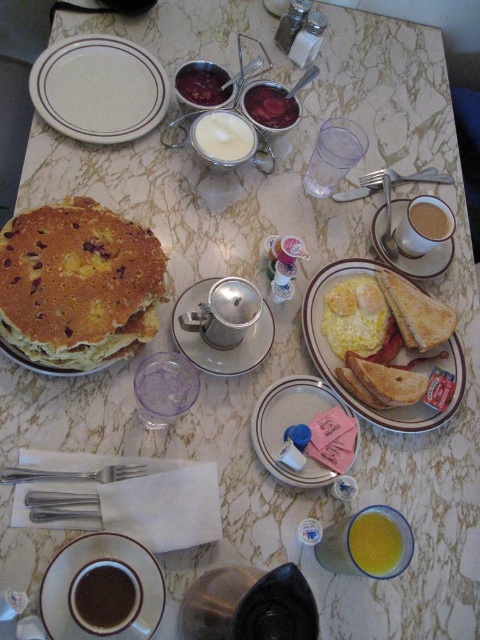
Question: In this image, where is pink paper at center located relative to dark brown liquid at bottom left?

Choices:
 (A) below
 (B) above

Answer: (B)

Question: Does translucent glass juice at lower center have a larger size compared to silver metallic fork at lower left?

Choices:
 (A) yes
 (B) no

Answer: (A)

Question: Which point is farther to the camera?

Choices:
 (A) (412, 227)
 (B) (36, 100)
 (C) (128, 580)

Answer: (B)

Question: Is pink paper at center thinner than silver metallic fork at lower left?

Choices:
 (A) yes
 (B) no

Answer: (A)

Question: Which object is closer to the camera taking this photo?

Choices:
 (A) white ceramic saucer at center
 (B) silver metallic fork at lower left
 (C) brown matte coffee cup at center

Answer: (B)

Question: Which point appears farthest from the camera in this image?

Choices:
 (A) (445, 225)
 (B) (253, 304)
 (C) (50, 211)
 (D) (350, 193)

Answer: (D)